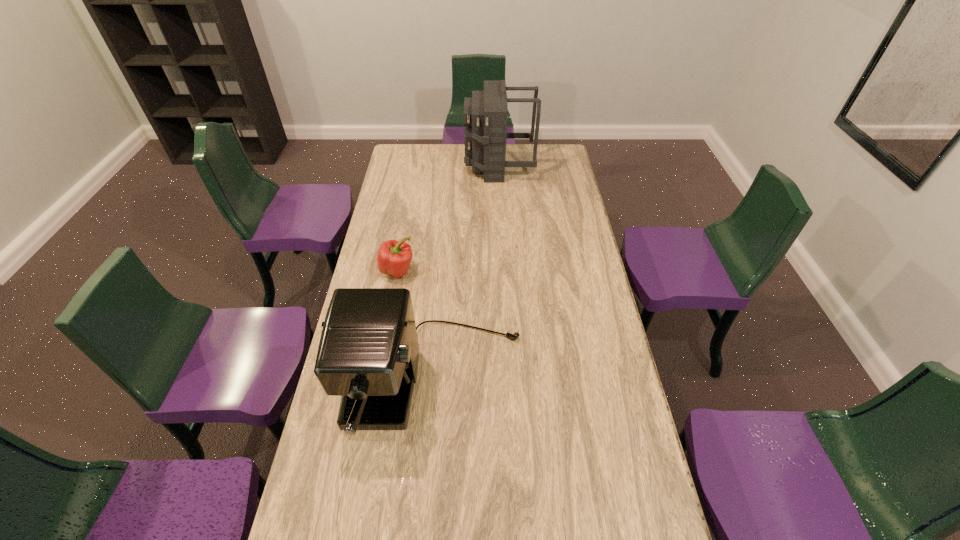
Where is `vacant space situated on the back of the second farthest object`? vacant space situated on the back of the second farthest object is located at coordinates (405, 232).

You are a GUI agent. You are given a task and a screenshot of the screen. Output one action in this format:
    pyautogui.click(x=<x>, y=<y>)
    Task: Click on the object at the far edge
    
    Given the screenshot: What is the action you would take?
    pyautogui.click(x=485, y=114)

Find the location of a particular element. The image size is (960, 540). coffee maker that is at the left edge is located at coordinates (368, 354).

The width and height of the screenshot is (960, 540). I want to click on bell pepper located in the left edge section of the desktop, so click(x=394, y=258).

In the image, there is a desktop. What are the coordinates of `vacant space at the left edge` in the screenshot? It's located at (321, 443).

The width and height of the screenshot is (960, 540). In the image, there is a desktop. In order to click on vacant space at the right edge in this screenshot , I will do `click(574, 212)`.

Where is `free area in between the backpack and the shortest object`? free area in between the backpack and the shortest object is located at coordinates 448,218.

Identify the location of unoccupied area between the backpack and the second farthest object. (448, 218).

Where is `vacant area that lies between the tallest object and the coffee maker`? Image resolution: width=960 pixels, height=540 pixels. vacant area that lies between the tallest object and the coffee maker is located at coordinates (467, 274).

The image size is (960, 540). In order to click on vacant point located between the tallest object and the shortest object in this screenshot , I will do `click(448, 218)`.